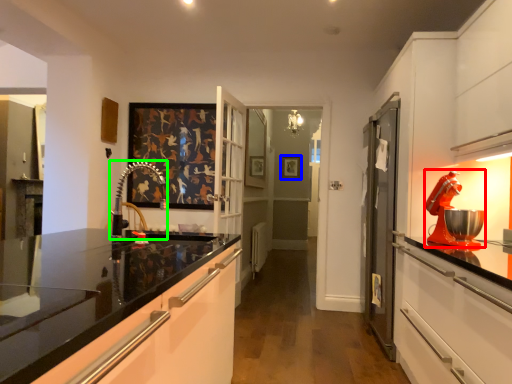
Question: Based on their relative distances, which object is farther from home appliance (highlighted by a red box)? Choose from picture frame (highlighted by a blue box) and faucet (highlighted by a green box).

Choices:
 (A) picture frame
 (B) faucet

Answer: (A)